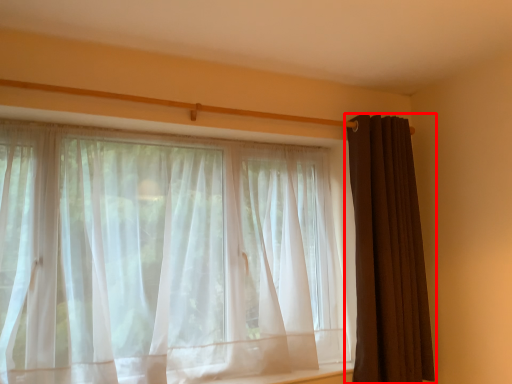
Question: From the image's perspective, considering the relative positions of curtain (annotated by the red box) and curtain in the image provided, where is curtain (annotated by the red box) located with respect to the staircase?

Choices:
 (A) below
 (B) above

Answer: (B)